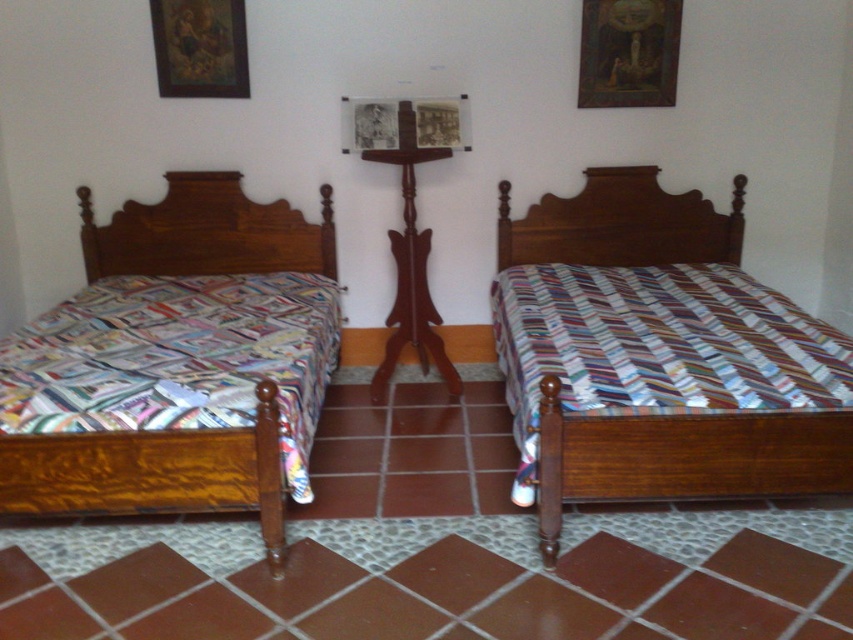
Does wooden bed at left appear over wooden picture frame at upper left?

No.

Is point (125, 500) in front of point (154, 48)?

Yes, point (125, 500) is closer to viewer.

Is point (161, 476) positioned before point (242, 48)?

Yes, point (161, 476) is closer to viewer.

This screenshot has height=640, width=853. I want to click on wooden bed at left, so click(x=152, y=472).

Does wooden bed at center have a smaller size compared to wooden picture frame at upper left?

Actually, wooden bed at center might be larger than wooden picture frame at upper left.

Can you confirm if wooden bed at center is shorter than wooden picture frame at upper left?

No.

What do you see at coordinates (685, 460) in the screenshot? Image resolution: width=853 pixels, height=640 pixels. I see `wooden bed at center` at bounding box center [685, 460].

I want to click on wooden bed at center, so click(x=685, y=460).

Between wooden bed at left and wooden bed at center, which one is positioned lower?

wooden bed at left is below.

Which is more to the right, wooden bed at left or wooden bed at center?

wooden bed at center

I want to click on wooden bed at left, so click(x=152, y=472).

At what (x,y) coordinates should I click in order to perform the action: click on wooden bed at left. Please return your answer as a coordinate pair (x, y). This screenshot has height=640, width=853. Looking at the image, I should click on (152, 472).